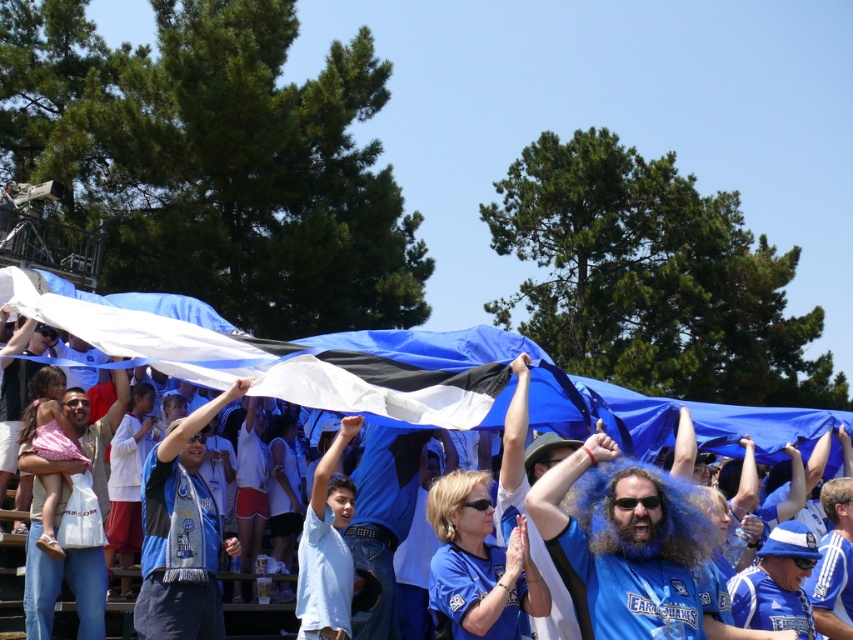
Is blue fabric flag at center smaller than blue fabric wig at center?

Actually, blue fabric flag at center might be larger than blue fabric wig at center.

Between blue fabric flag at center and blue fabric wig at center, which one appears on the right side from the viewer's perspective?

From the viewer's perspective, blue fabric wig at center appears more on the right side.

Between point (454, 388) and point (596, 500), which one is positioned behind?

The point (454, 388) is behind.

Find the location of `blue fabric flag at center`. blue fabric flag at center is located at coordinates (285, 362).